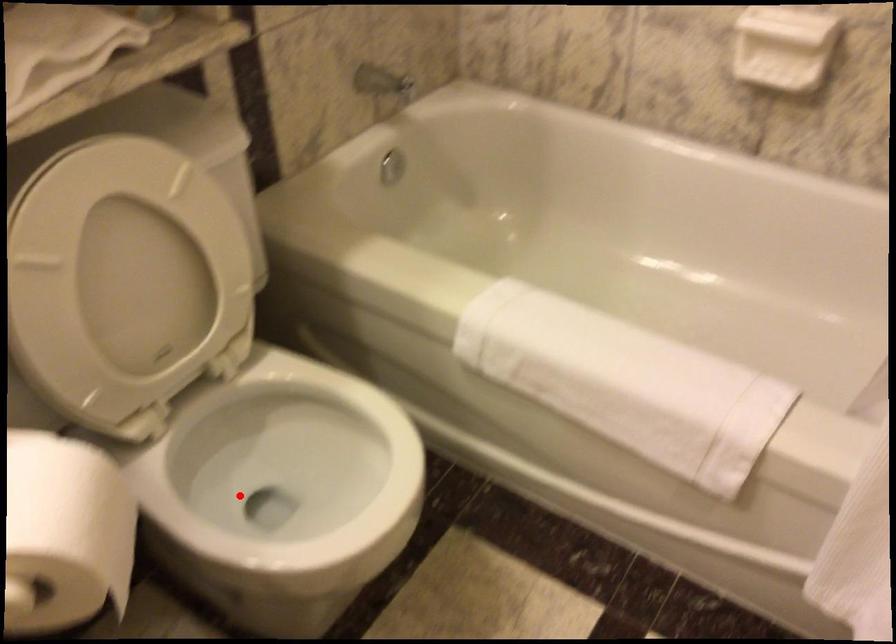
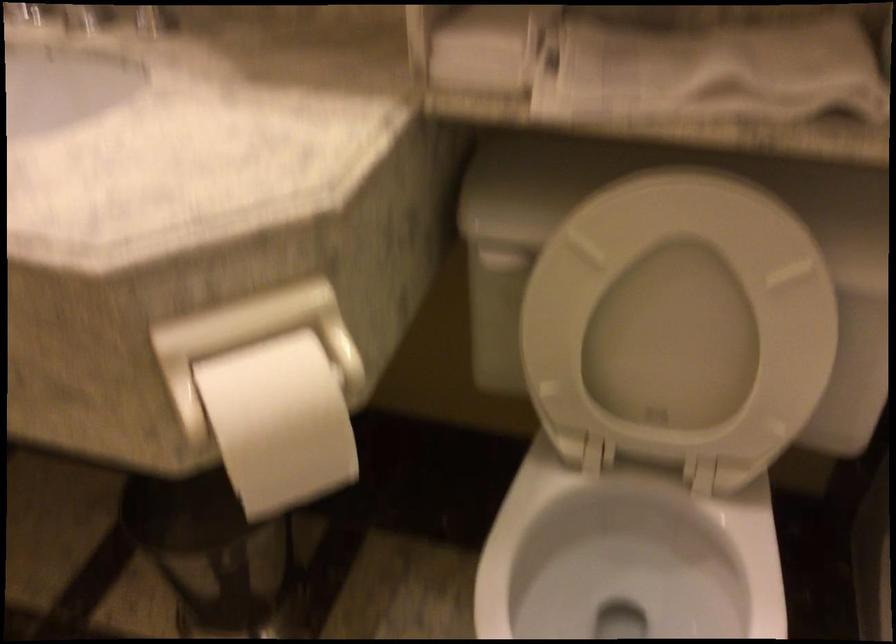
Question: I am providing you with two images of the same scene from different viewpoints. A red point is marked on the first image. At the location where the point appears in image 1, is it still visible in image 2?

Choices:
 (A) Yes
 (B) No

Answer: (A)